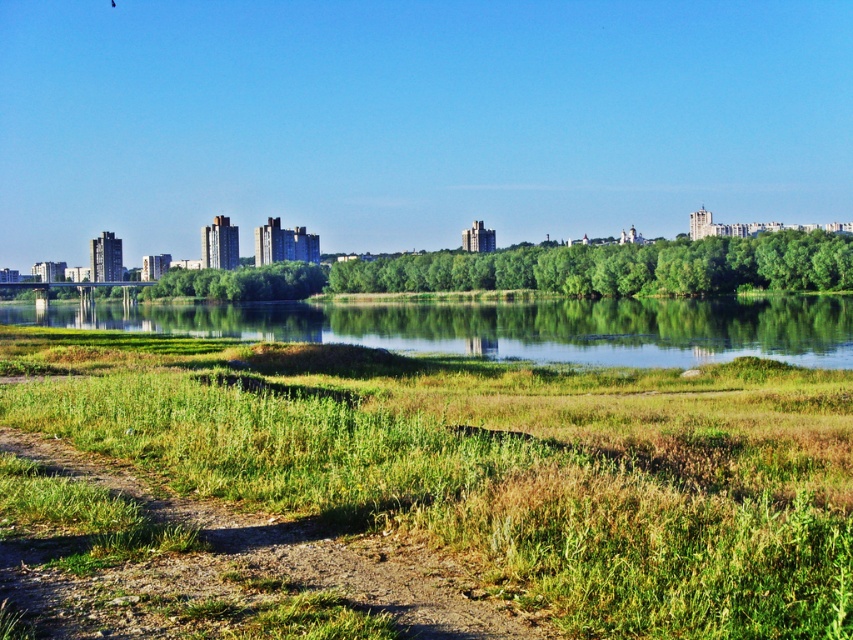
Question: Considering the real-world distances, which object is farthest from the green grassy river at center?

Choices:
 (A) green grass at lower center
 (B) dirt/gravel path at lower left

Answer: (B)

Question: Estimate the real-world distances between objects in this image. Which object is farther from the dirt/gravel path at lower left?

Choices:
 (A) green grassy river at center
 (B) green grass at lower center

Answer: (A)

Question: Considering the relative positions of dirt/gravel path at lower left and green grassy river at center in the image provided, where is dirt/gravel path at lower left located with respect to green grassy river at center?

Choices:
 (A) left
 (B) right

Answer: (B)

Question: Does green grass at lower center appear on the left side of green grassy river at center?

Choices:
 (A) yes
 (B) no

Answer: (B)

Question: Can you confirm if green grass at lower center is positioned to the left of green grassy river at center?

Choices:
 (A) yes
 (B) no

Answer: (B)

Question: Which point is farther to the camera?

Choices:
 (A) (785, 337)
 (B) (726, 476)
 (C) (144, 618)

Answer: (A)